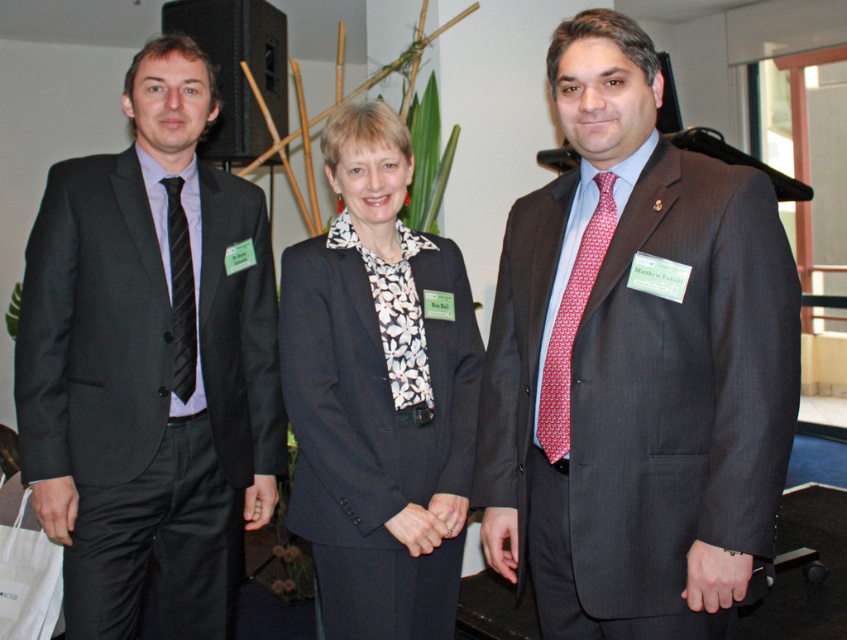
Question: Which object is closer to the camera taking this photo?

Choices:
 (A) red dotted fabric tie at center
 (B) matte gray suit at center
 (C) matte black suit at left
 (D) black striped tie at left

Answer: (B)

Question: Is matte black suit at left below black textured blazer at center?

Choices:
 (A) yes
 (B) no

Answer: (B)

Question: Which of these objects is positioned farthest from the matte black suit at left?

Choices:
 (A) black striped tie at left
 (B) black textured blazer at center
 (C) red dotted fabric tie at center

Answer: (C)

Question: Estimate the real-world distances between objects in this image. Which object is farther from the red dotted fabric tie at center?

Choices:
 (A) matte gray suit at center
 (B) matte black suit at left
 (C) black textured blazer at center

Answer: (B)

Question: Is matte black suit at left to the left of red dotted fabric tie at center from the viewer's perspective?

Choices:
 (A) yes
 (B) no

Answer: (A)

Question: Is black textured blazer at center to the right of red dotted fabric tie at center from the viewer's perspective?

Choices:
 (A) no
 (B) yes

Answer: (A)